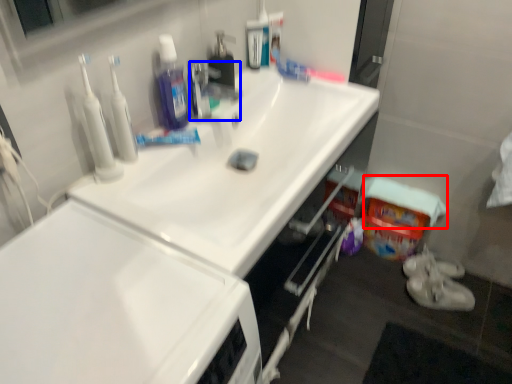
Question: Which of the following is the closest to the observer, towel/napkin (highlighted by a red box) or faucet (highlighted by a blue box)?

Choices:
 (A) towel/napkin
 (B) faucet

Answer: (B)